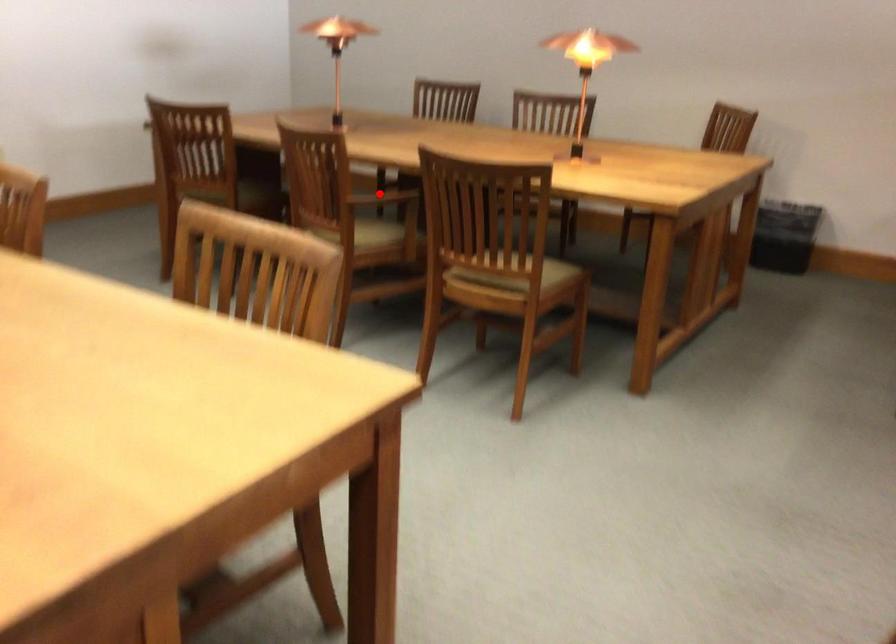
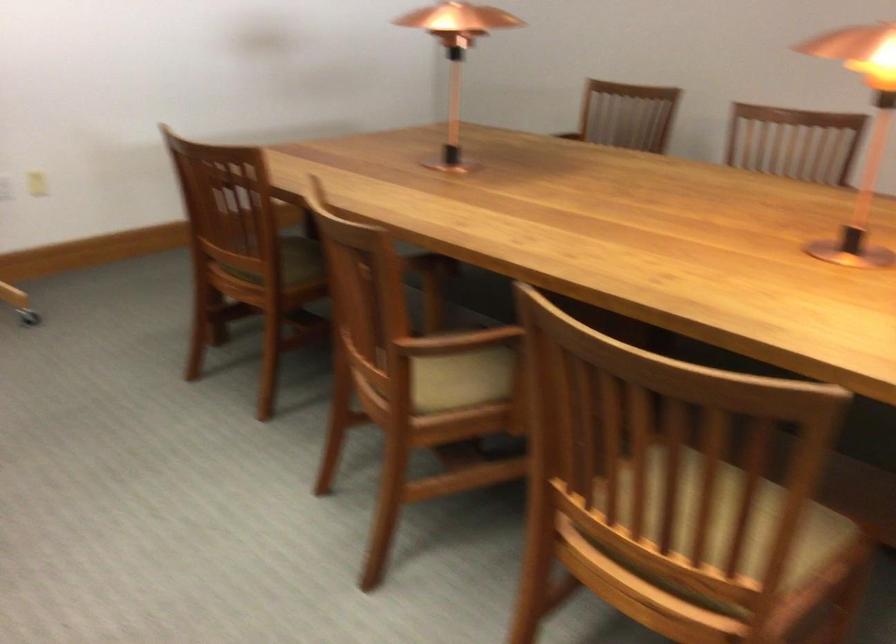
Where in the second image is the point corresponding to the highlighted location from the first image?

(455, 342)